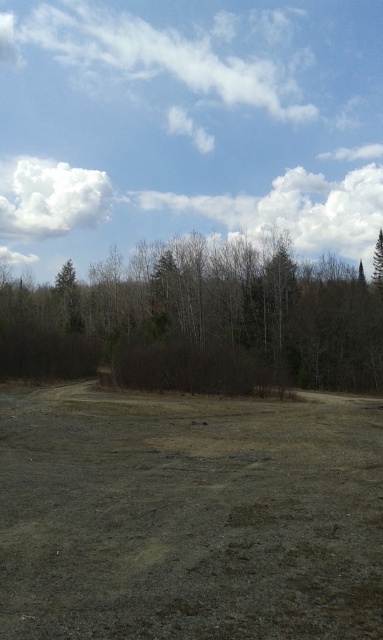
You are standing at the point with coordinates point (121, 348) and want to walk towards the forest edge. Is the point point (93, 518) located between you and the forest edge?

Yes, the point (93, 518) is located between you and the forest edge because it is in front of point (121, 348) where you are standing.